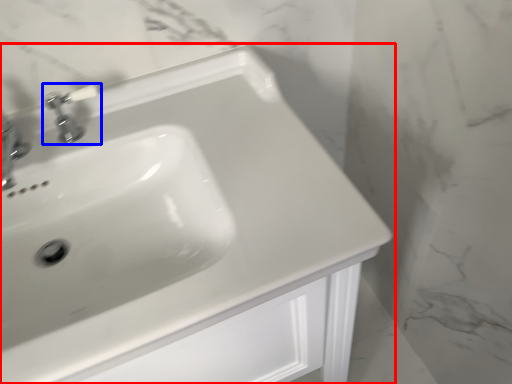
Question: Which point is closer to the camera, sink (highlighted by a red box) or tap (highlighted by a blue box)?

Choices:
 (A) sink
 (B) tap

Answer: (A)